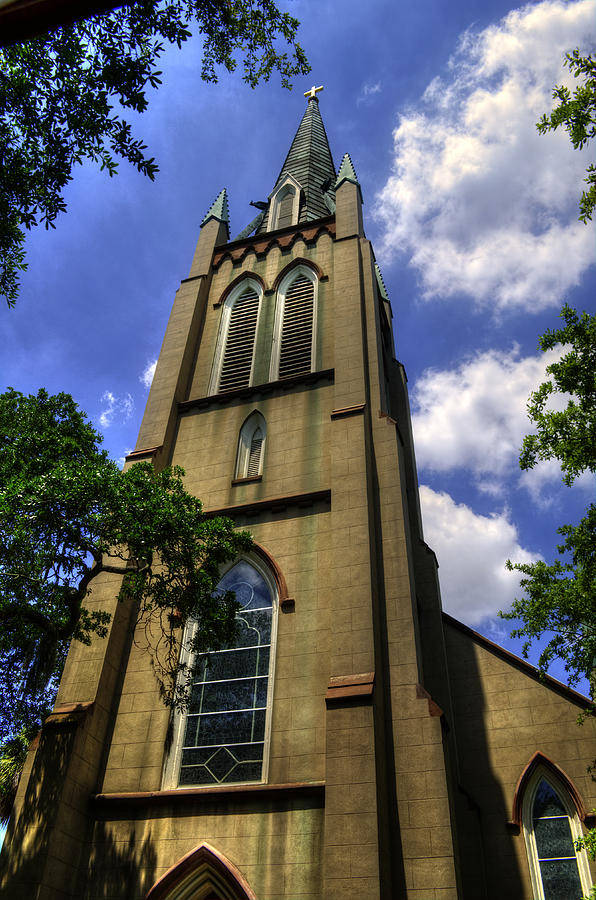
I want to click on window pane, so click(273, 607), click(530, 838).